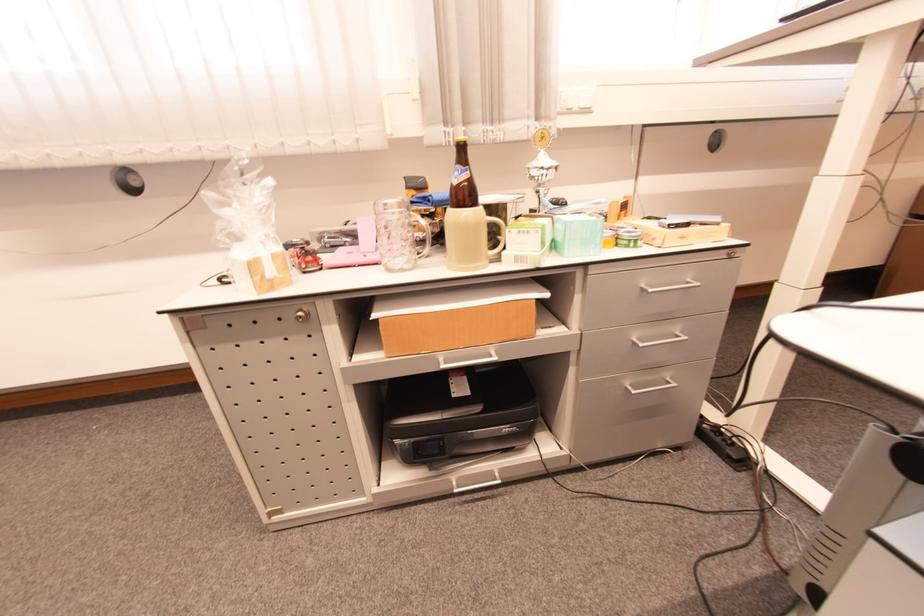
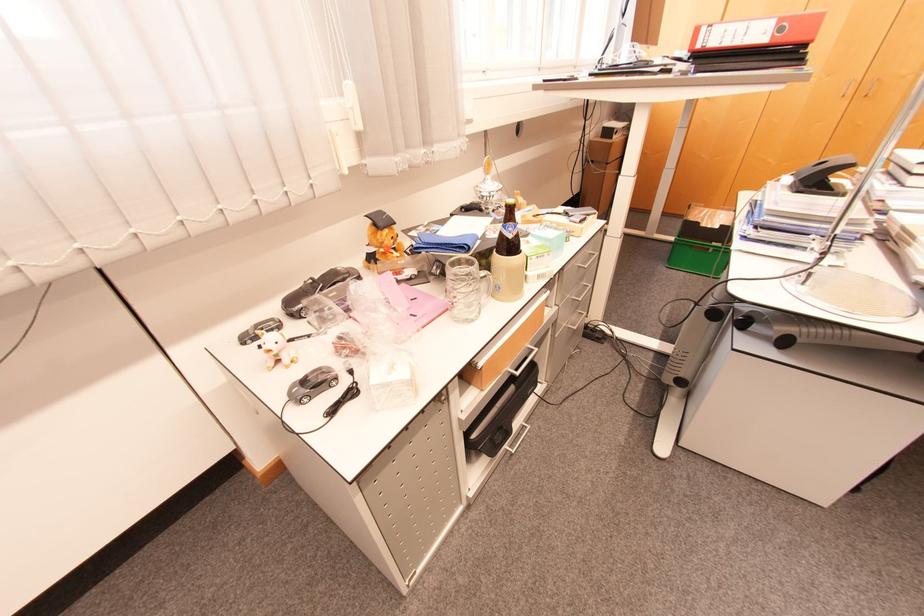
Question: The camera is either moving clockwise (left) or counter-clockwise (right) around the object. The first image is from the beginning of the video and the second image is from the end. Is the camera moving left or right when shooting the video?

Choices:
 (A) Left
 (B) Right

Answer: (A)